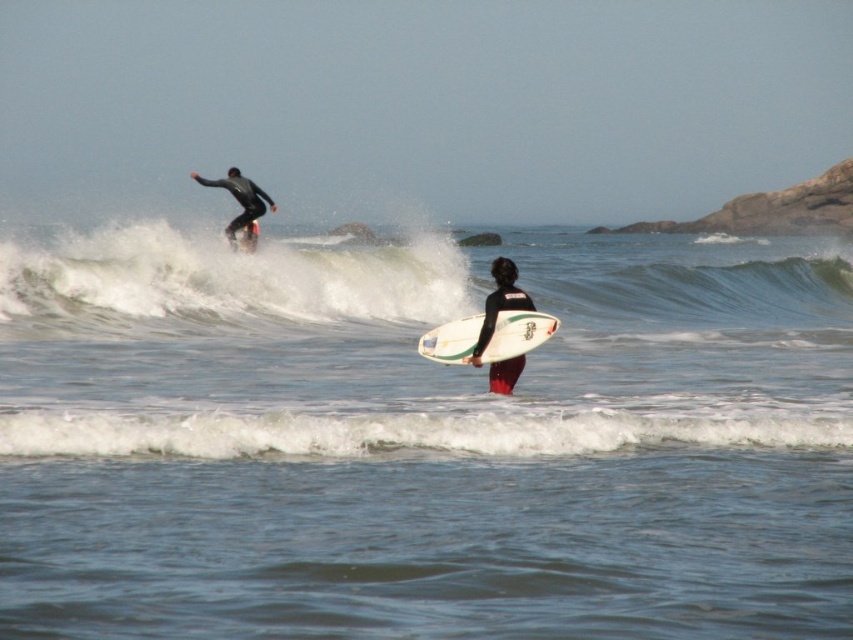
Question: Is clear blue water at center thinner than white glossy surfboard at center?

Choices:
 (A) no
 (B) yes

Answer: (A)

Question: Which object is positioned farthest from the white smooth wave at center?

Choices:
 (A) clear blue water at center
 (B) white glossy surfboard at center

Answer: (B)

Question: Which is farther from the black matte wetsuit at upper left?

Choices:
 (A) white glossy surfboard at center
 (B) black matte wetsuit at center

Answer: (B)

Question: Is white glossy surfboard at center wider than black matte wetsuit at center?

Choices:
 (A) yes
 (B) no

Answer: (A)

Question: Which point is farther from the camera taking this photo?

Choices:
 (A) (107, 636)
 (B) (231, 244)

Answer: (B)

Question: Considering the relative positions of white smooth wave at center and white glossy surfboard at center in the image provided, where is white smooth wave at center located with respect to white glossy surfboard at center?

Choices:
 (A) left
 (B) right

Answer: (B)